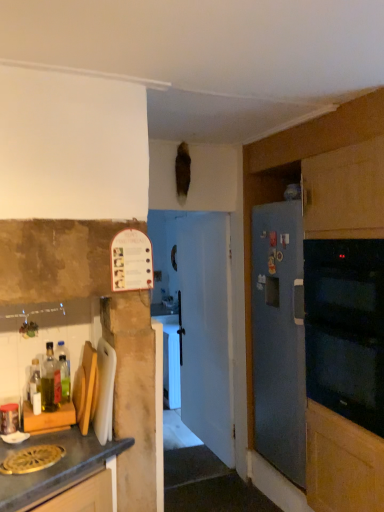
At what (x,y) coordinates should I click in order to perform the action: click on translucent plastic bottle at left, which is the first bottle from back to front. Please return your answer as a coordinate pair (x, y). The width and height of the screenshot is (384, 512). Looking at the image, I should click on (65, 378).

What do you see at coordinates (319, 185) in the screenshot? I see `blue matte refrigerator at right, the 1th cabinetry from the back` at bounding box center [319, 185].

Measure the distance between point (293, 158) and camera.

They are 7.88 feet apart.

Identify the location of metallic glass jar at left. The height and width of the screenshot is (512, 384). (9, 418).

The height and width of the screenshot is (512, 384). Find the location of `matte wood cutting board at lower left, marked as the first cabinetry in a left-to-right arrangement`. matte wood cutting board at lower left, marked as the first cabinetry in a left-to-right arrangement is located at coordinates (55, 467).

The image size is (384, 512). What do you see at coordinates (55, 467) in the screenshot? I see `matte wood cutting board at lower left, placed as the first cabinetry when sorted from front to back` at bounding box center [55, 467].

This screenshot has width=384, height=512. In order to click on white glossy door at center in this screenshot , I will do tap(206, 329).

How many degrees apart are the facing directions of translucent plastic bottle at left, which is the first bottle from back to front, and metallic glass jar at left?

The angle between the facing direction of translucent plastic bottle at left, which is the first bottle from back to front, and the facing direction of metallic glass jar at left is 2.07 degrees.

In the image, is translucent plastic bottle at left, which is the first bottle from back to front, positioned in front of or behind metallic glass jar at left?

In the image, translucent plastic bottle at left, which is the first bottle from back to front, appears behind metallic glass jar at left.

Between translucent plastic bottle at left, which is the 2th bottle in front-to-back order, and metallic glass jar at left, which one has larger size?

With larger size is translucent plastic bottle at left, which is the 2th bottle in front-to-back order.

Is translucent plastic bottle at left, which is the 2th bottle in front-to-back order, at the left side of metallic glass jar at left?

No, translucent plastic bottle at left, which is the 2th bottle in front-to-back order, is not to the left of metallic glass jar at left.

Considering the points (62, 373) and (207, 434), which point is behind, point (62, 373) or point (207, 434)?

The point (207, 434) is farther from the camera.

Does translucent plastic bottle at left, which is the 2th bottle in front-to-back order, have a greater height compared to white glossy door at center?

No, translucent plastic bottle at left, which is the 2th bottle in front-to-back order, is not taller than white glossy door at center.

From the picture: Could you tell me if translucent plastic bottle at left, which is the 2th bottle in front-to-back order, is facing white glossy door at center?

No, translucent plastic bottle at left, which is the 2th bottle in front-to-back order, is not aimed at white glossy door at center.

From a real-world perspective, which is physically above, translucent plastic bottle at left, which is the 2th bottle in front-to-back order, or white glossy door at center?

From a 3D spatial view, translucent plastic bottle at left, which is the 2th bottle in front-to-back order, is above.

From a real-world perspective, which is physically below, matte wood cutting board at lower left, placed as the first cabinetry when sorted from front to back, or metallic glass jar at left?

In real-world perspective, matte wood cutting board at lower left, placed as the first cabinetry when sorted from front to back, is lower.

Which object is positioned more to the right, matte wood cutting board at lower left, placed as the first cabinetry when sorted from front to back, or metallic glass jar at left?

Positioned to the right is matte wood cutting board at lower left, placed as the first cabinetry when sorted from front to back.

Is metallic glass jar at left completely or partially inside matte wood cutting board at lower left, which is the second cabinetry in right-to-left order?

No, metallic glass jar at left is not inside matte wood cutting board at lower left, which is the second cabinetry in right-to-left order.

Relative to metallic glass jar at left, is matte wood cutting board at lower left, marked as the first cabinetry in a left-to-right arrangement, in front or behind?

matte wood cutting board at lower left, marked as the first cabinetry in a left-to-right arrangement, is in front of metallic glass jar at left.

Considering the sizes of objects metallic glass jar at left and translucent glass bottle at left, the 2th bottle viewed from the back, in the image provided, who is shorter, metallic glass jar at left or translucent glass bottle at left, the 2th bottle viewed from the back,?

With less height is metallic glass jar at left.

Which object is more forward, metallic glass jar at left or translucent glass bottle at left, the 2th bottle viewed from the back?

metallic glass jar at left is in front.

From the image's perspective, is metallic glass jar at left above translucent glass bottle at left, the 2th bottle viewed from the back?

Incorrect, from the image's perspective, metallic glass jar at left is lower than translucent glass bottle at left, the 2th bottle viewed from the back.

How many degrees apart are the facing directions of black glass oven at right and translucent plastic bottle at left, which is the first bottle from back to front?

The angle between the facing direction of black glass oven at right and the facing direction of translucent plastic bottle at left, which is the first bottle from back to front, is 92 degrees.

Can we say black glass oven at right lies outside translucent plastic bottle at left, which is the first bottle from back to front?

Yes, black glass oven at right is located beyond the bounds of translucent plastic bottle at left, which is the first bottle from back to front.

Does black glass oven at right have a greater height compared to translucent plastic bottle at left, which is the 2th bottle in front-to-back order?

Yes.

Is black glass oven at right far from translucent plastic bottle at left, which is the first bottle from back to front?

Yes, black glass oven at right is far from translucent plastic bottle at left, which is the first bottle from back to front.

Is translucent plastic bottle at left, which is the first bottle from back to front, taller or shorter than white plastic cutting board at left?

Considering their sizes, translucent plastic bottle at left, which is the first bottle from back to front, has less height than white plastic cutting board at left.

From a real-world perspective, is translucent plastic bottle at left, which is the first bottle from back to front, located beneath white plastic cutting board at left?

Actually, translucent plastic bottle at left, which is the first bottle from back to front, is physically above white plastic cutting board at left in the real world.

Does point (68, 372) come farther from viewer compared to point (95, 384)?

That is True.

Is matte wood cutting board at lower left, which is the second cabinetry in right-to-left order, inside the boundaries of blue matte refrigerator at right, the first cabinetry viewed from the right, or outside?

The correct answer is: outside.

Is the surface of matte wood cutting board at lower left, placed as the first cabinetry when sorted from front to back, in direct contact with blue matte refrigerator at right, which is counted as the second cabinetry, starting from the left?

matte wood cutting board at lower left, placed as the first cabinetry when sorted from front to back, is not next to blue matte refrigerator at right, which is counted as the second cabinetry, starting from the left, and they're not touching.

You are a GUI agent. You are given a task and a screenshot of the screen. Output one action in this format:
    pyautogui.click(x=<x>, y=<y>)
    Task: Click on the cabinetry on the right of matte wood cutting board at lower left, positioned as the second cabinetry in back-to-front order
    
    Given the screenshot: What is the action you would take?
    pyautogui.click(x=319, y=185)

Locate an element on the screen. The image size is (384, 512). the 2nd bottle behind when counting from the metallic glass jar at left is located at coordinates [65, 378].

You are a GUI agent. You are given a task and a screenshot of the screen. Output one action in this format:
    pyautogui.click(x=<x>, y=<y>)
    Task: Click on the door lying on the right of translucent plastic bottle at left, which is the first bottle from back to front
    The height and width of the screenshot is (512, 384).
    Given the screenshot: What is the action you would take?
    pyautogui.click(x=206, y=329)

In the scene shown: Estimate the real-world distances between objects in this image. Which object is closer to white glossy door at center, translucent glass bottle at left, the 2th bottle viewed from the back, or blue matte refrigerator at right, which is counted as the second cabinetry, starting from the left?

Among the two, blue matte refrigerator at right, which is counted as the second cabinetry, starting from the left, is located nearer to white glossy door at center.

From the image, which object appears to be nearer to translucent plastic bottle at left, which is the first bottle from back to front, white plastic cutting board at left or metallic glass jar at left?

metallic glass jar at left lies closer to translucent plastic bottle at left, which is the first bottle from back to front, than the other object.

Which object lies nearer to the anchor point metallic glass jar at left, translucent plastic bottle at left, which is the 2th bottle in front-to-back order, or white plastic cutting board at left?

translucent plastic bottle at left, which is the 2th bottle in front-to-back order, lies closer to metallic glass jar at left than the other object.

Estimate the real-world distances between objects in this image. Which object is further from white plastic cutting board at left, blue matte refrigerator at right, the first cabinetry viewed from the right, or matte wood cutting board at lower left, placed as the first cabinetry when sorted from front to back?

Based on the image, blue matte refrigerator at right, the first cabinetry viewed from the right, appears to be further to white plastic cutting board at left.

In the scene shown: Estimate the real-world distances between objects in this image. Which object is closer to white glossy door at center, matte wood cutting board at lower left, positioned as the second cabinetry in back-to-front order, or translucent plastic bottle at left, which is the 2th bottle in front-to-back order?

Based on the image, translucent plastic bottle at left, which is the 2th bottle in front-to-back order, appears to be nearer to white glossy door at center.

Estimate the real-world distances between objects in this image. Which object is further from white glossy door at center, blue matte refrigerator at right, which is counted as the second cabinetry, starting from the left, or translucent plastic bottle at left, which is the first bottle from back to front?

translucent plastic bottle at left, which is the first bottle from back to front, lies further to white glossy door at center than the other object.

Considering their positions, is white glossy door at center positioned closer to black glass oven at right than translucent plastic bottle at left, which is the first bottle from back to front?

white glossy door at center is closer to black glass oven at right.

Which object lies nearer to the anchor point blue matte refrigerator at right, acting as the 2th cabinetry starting from the front, matte wood cutting board at lower left, marked as the first cabinetry in a left-to-right arrangement, or white glossy door at center?

white glossy door at center lies closer to blue matte refrigerator at right, acting as the 2th cabinetry starting from the front, than the other object.

What are the coordinates of `appliance located between matte wood cutting board at lower left, positioned as the second cabinetry in back-to-front order, and black glass oven at right in the left-right direction` in the screenshot? It's located at (104, 391).

This screenshot has width=384, height=512. What are the coordinates of `appliance between matte wood cutting board at lower left, which is the second cabinetry in right-to-left order, and blue matte refrigerator at right, the 1th cabinetry from the back, from left to right` in the screenshot? It's located at pyautogui.click(x=104, y=391).

Identify the location of cabinetry between matte wood cutting board at lower left, marked as the first cabinetry in a left-to-right arrangement, and black glass oven at right, in the horizontal direction. [x=319, y=185].

Locate an element on the screen. The width and height of the screenshot is (384, 512). bottle between translucent plastic bottle at left, which is the first bottle from back to front, and black glass oven at right, in the horizontal direction is located at coordinates (50, 381).